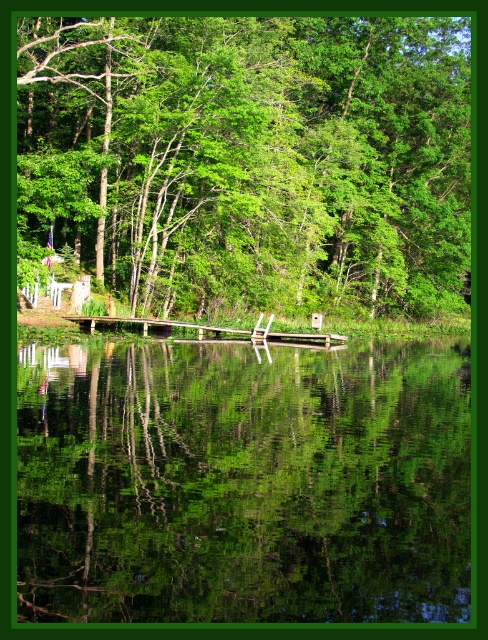
You are standing at the point marked as point (251, 157) in the image. What object is located exactly at this point?

The green leafy tree at upper center is located exactly at point (251, 157).

You are standing at the lakeside and want to take a photo of both the point at coordinates point (206, 260) and point (175, 604) in the scene. Which point should you focus on first to ensure both are in clear view?

You should focus on point (206, 260) first because it is closer to you than point (175, 604), ensuring both are in clear view.

You are standing at the lakeside and want to take a photo of the green leafy tree at upper center and the green reflective water at center. Which object should you adjust your camera to focus on first if you want to capture both in the frame without moving your position?

The green leafy tree at upper center is to the right of green reflective water at center, so you should focus on the green reflective water at center first to ensure both are in frame.